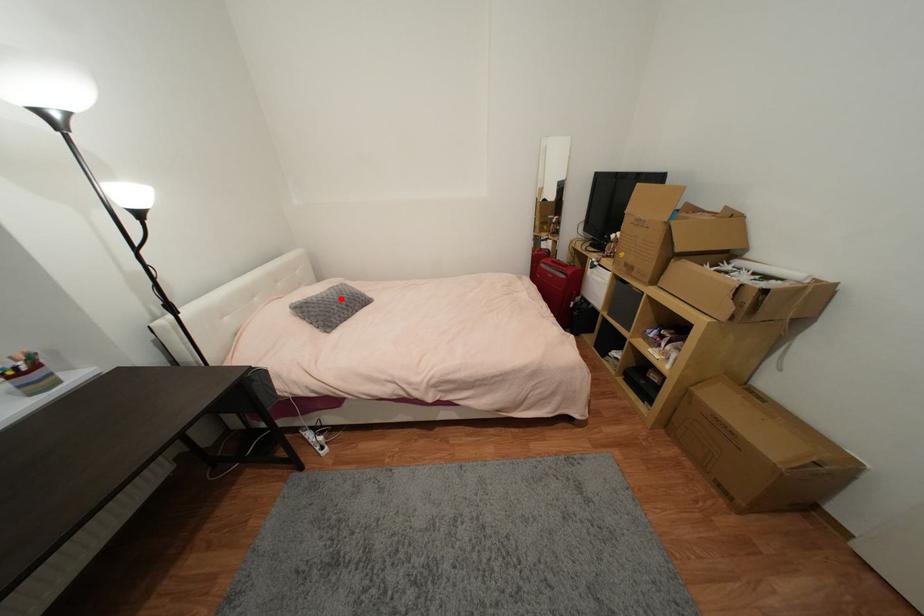
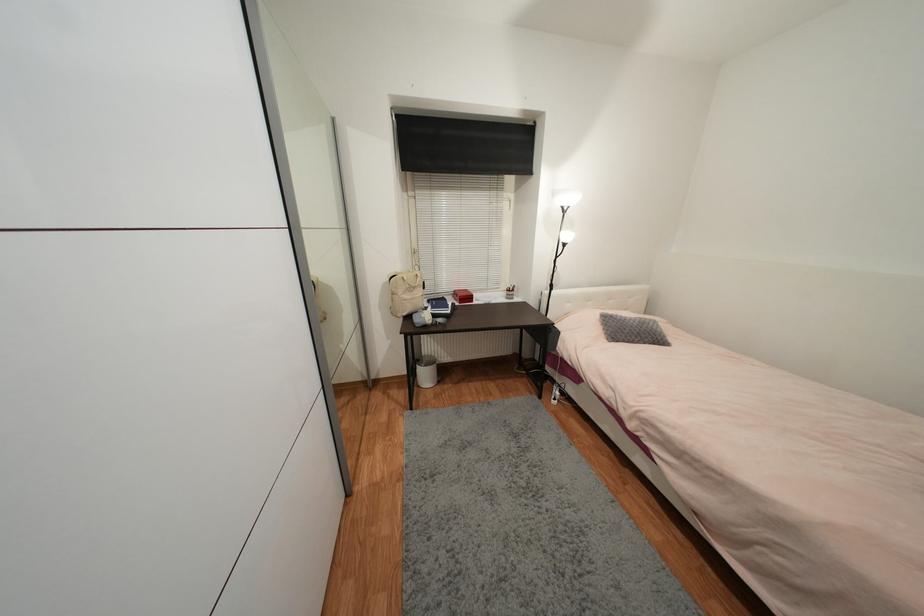
Where in the second image is the point corresponding to the highlighted location from the first image?

(639, 326)